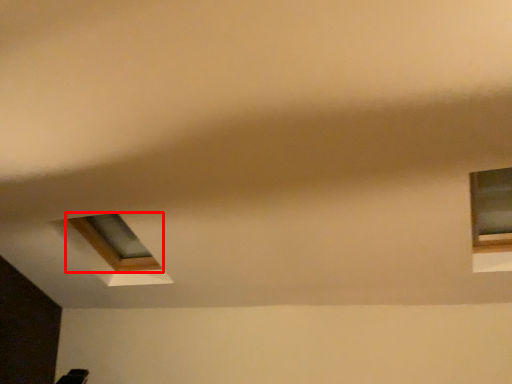
Question: From the image's perspective, where is window (annotated by the red box) located relative to window?

Choices:
 (A) above
 (B) below

Answer: (B)